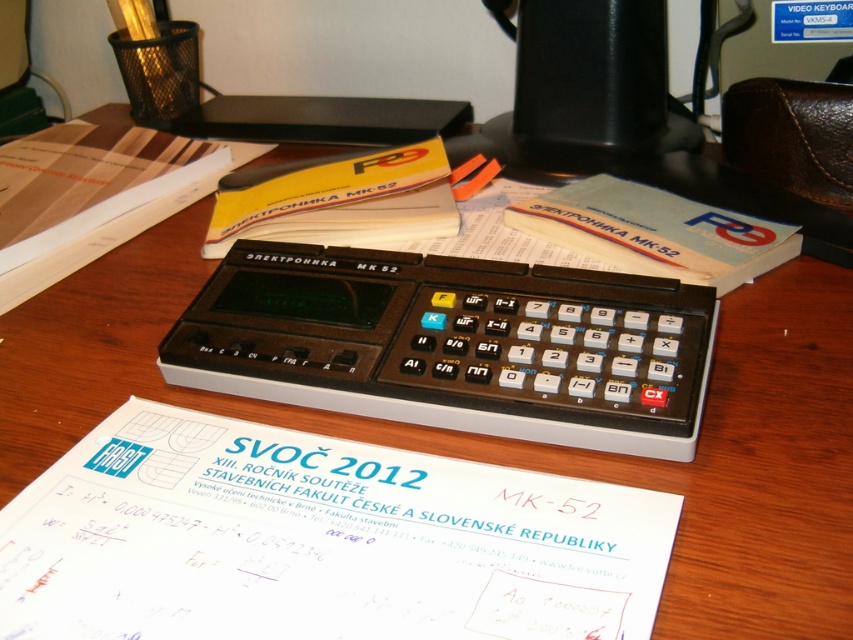
Question: Which point is farther to the camera?

Choices:
 (A) black plastic calculator at center
 (B) white paper at center

Answer: (A)

Question: Observing the image, what is the correct spatial positioning of white paper at center in reference to black plastic calculator at center?

Choices:
 (A) below
 (B) above

Answer: (A)

Question: Among these objects, which one is farthest from the camera?

Choices:
 (A) white paper at center
 (B) black plastic calculator at center

Answer: (B)

Question: Does white paper at center have a smaller size compared to black plastic calculator at center?

Choices:
 (A) no
 (B) yes

Answer: (B)

Question: Does white paper at center have a larger size compared to black plastic calculator at center?

Choices:
 (A) yes
 (B) no

Answer: (B)